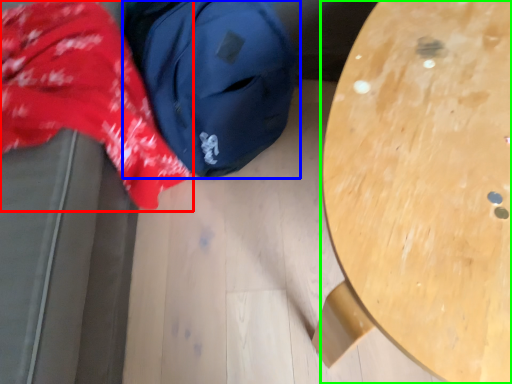
Question: Estimate the real-world distances between objects in this image. Which object is closer to clothing (highlighted by a red box), backpack (highlighted by a blue box) or table (highlighted by a green box)?

Choices:
 (A) backpack
 (B) table

Answer: (A)